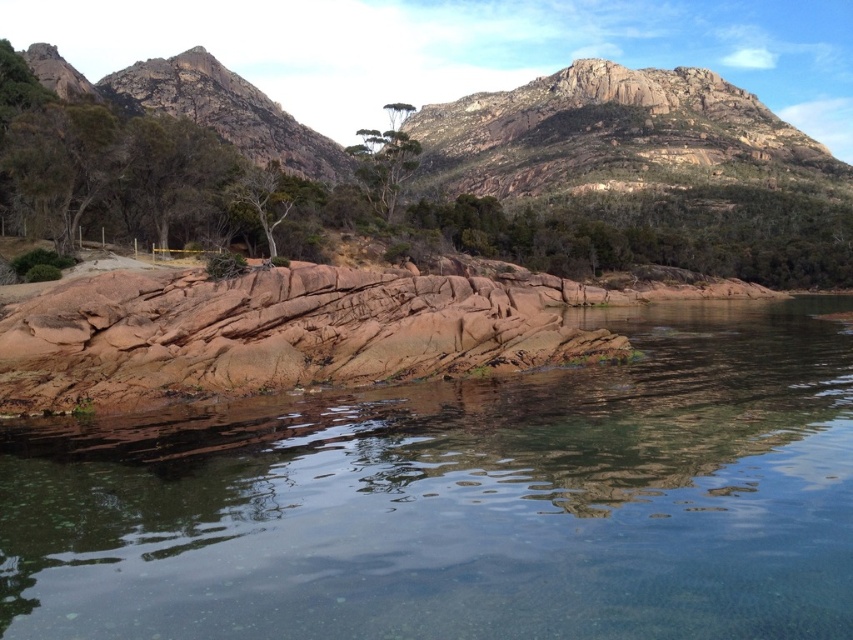
You are a hiker who wants to cross from the rustic stone rock at center to the green textured tree at center. The distance between them is 229.93 feet. Can you estimate how long it would take you to walk this distance at a normal pace?

The rustic stone rock at center is 229.93 feet from the green textured tree at center. At a normal walking pace of about 3 feet per second, it would take approximately 76.6 seconds, or roughly 1 minute and 17 seconds, to walk between them.

You are a photographer trying to capture both the clear glass water at center and the green textured tree at center in a single shot. Based on their sizes in the image, which one will appear larger in your photo?

The green textured tree at center appears larger in the photo because the clear glass water at center has a smaller size compared to it.